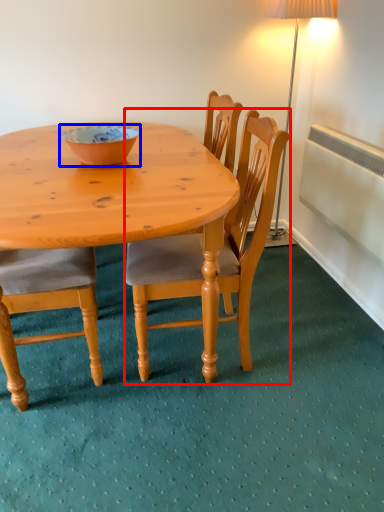
Question: Which point is closer to the camera, chair (highlighted by a red box) or bowl (highlighted by a blue box)?

Choices:
 (A) chair
 (B) bowl

Answer: (A)